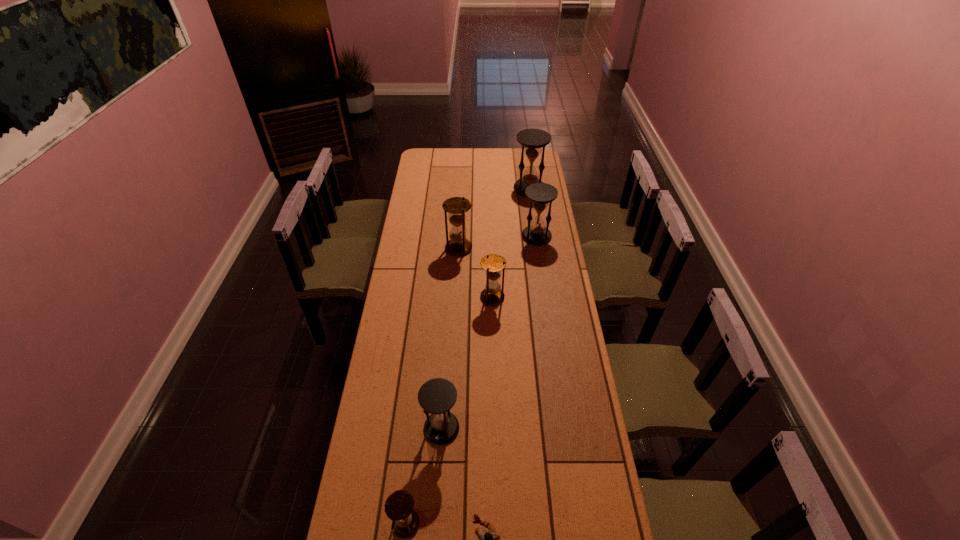
Point out which hourglass is positioned as the second nearest to the second brown hourglass from right to left. Please provide its 2D coordinates. Your answer should be formatted as a tuple, i.e. [(x, y)], where the tuple contains the x and y coordinates of a point satisfying the conditions above.

[(537, 233)]

Identify which black hourglass is the closest to the tallest object. Please provide its 2D coordinates. Your answer should be formatted as a tuple, i.e. [(x, y)], where the tuple contains the x and y coordinates of a point satisfying the conditions above.

[(537, 233)]

Image resolution: width=960 pixels, height=540 pixels. I want to click on black hourglass that stands as the third closest to the leftmost brown hourglass, so click(532, 140).

Point out which brown hourglass is positioned as the nearest to the rightmost brown hourglass. Please provide its 2D coordinates. Your answer should be formatted as a tuple, i.e. [(x, y)], where the tuple contains the x and y coordinates of a point satisfying the conditions above.

[(456, 206)]

Find the location of a particular element. The height and width of the screenshot is (540, 960). brown hourglass that is the closest to the nearest brown hourglass is located at coordinates (493, 264).

What are the coordinates of `vacant space that satisfies the following two spatial constraints: 1. on the back side of the fourth farthest object; 2. on the right side of the smallest brown hourglass` in the screenshot? It's located at (430, 297).

Where is `free point that satisfies the following two spatial constraints: 1. on the back side of the leftmost brown hourglass; 2. on the right side of the fourth farthest object`? This screenshot has width=960, height=540. free point that satisfies the following two spatial constraints: 1. on the back side of the leftmost brown hourglass; 2. on the right side of the fourth farthest object is located at coordinates (430, 297).